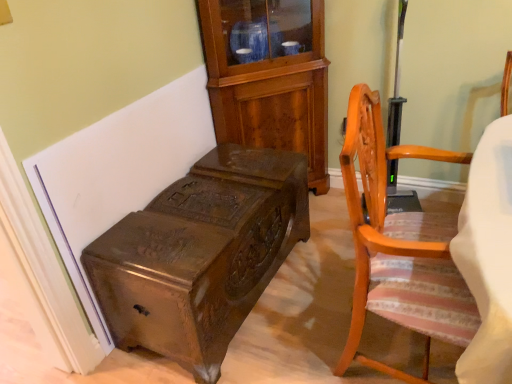
At what (x,y) coordinates should I click in order to perform the action: click on blank space above polished dark wood trunk at lower left (from a real-world perspective). Please return your answer as a coordinate pair (x, y). Looking at the image, I should click on (202, 200).